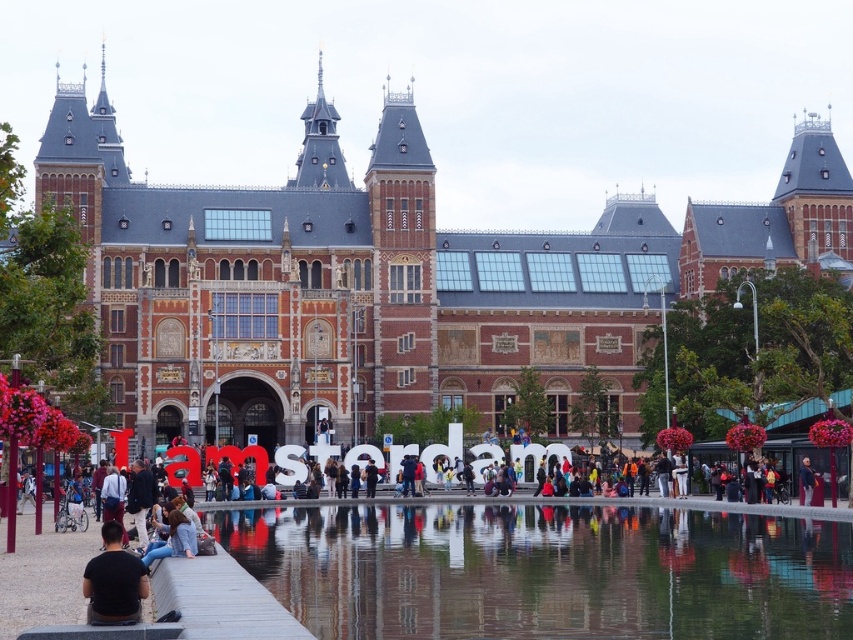
Question: Which of these objects is positioned closest to the reflective glass water at center?

Choices:
 (A) dark blue fabric pants at center
 (B) black matte shirt at lower left

Answer: (B)

Question: Considering the relative positions of reflective glass water at center and black matte shirt at lower left in the image provided, where is reflective glass water at center located with respect to black matte shirt at lower left?

Choices:
 (A) below
 (B) above

Answer: (A)

Question: Estimate the real-world distances between objects in this image. Which object is farther from the dark blue fabric pants at center?

Choices:
 (A) black matte shirt at lower left
 (B) reflective glass water at center

Answer: (A)

Question: Which of the following is the closest to the observer?

Choices:
 (A) reflective glass water at center
 (B) dark blue fabric pants at center

Answer: (A)

Question: Observing the image, what is the correct spatial positioning of reflective glass water at center in reference to black matte shirt at lower left?

Choices:
 (A) right
 (B) left

Answer: (A)

Question: Is reflective glass water at center to the left of dark blue fabric pants at center from the viewer's perspective?

Choices:
 (A) no
 (B) yes

Answer: (B)